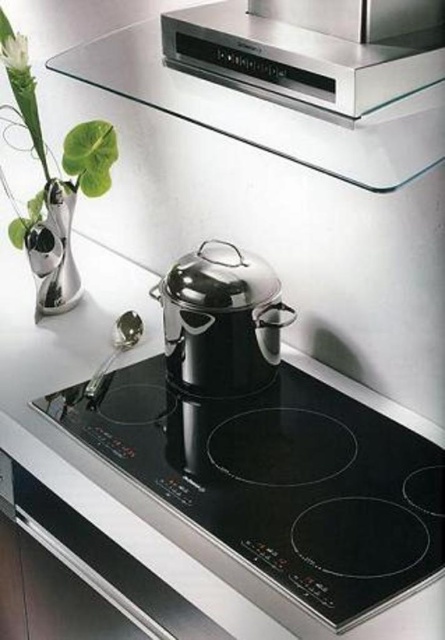
Is point (245, 288) closer to viewer compared to point (8, 40)?

Yes, it is in front of point (8, 40).

Who is positioned more to the left, polished stainless steel pot at center or white matte flower at upper left?

white matte flower at upper left is more to the left.

Which is in front, point (254, 272) or point (13, 52)?

Point (254, 272) is in front.

I want to click on polished stainless steel pot at center, so click(221, 321).

Between point (257, 448) and point (13, 44), which one is positioned behind?

Point (13, 44)

Which is in front, point (408, 500) or point (13, 54)?

Point (408, 500) is more forward.

You are a GUI agent. You are given a task and a screenshot of the screen. Output one action in this format:
    pyautogui.click(x=<x>, y=<y>)
    Task: Click on the black glass cooktop at center
    The height and width of the screenshot is (640, 445).
    Given the screenshot: What is the action you would take?
    pyautogui.click(x=274, y=484)

Does green leafy plant at left have a lesser height compared to white matte flower at upper left?

No.

Is green leafy plant at left to the right of white matte flower at upper left from the viewer's perspective?

Incorrect, green leafy plant at left is not on the right side of white matte flower at upper left.

The height and width of the screenshot is (640, 445). Describe the element at coordinates (89, 156) in the screenshot. I see `green leafy plant at left` at that location.

Identify the location of green leafy plant at left. pyautogui.click(x=89, y=156).